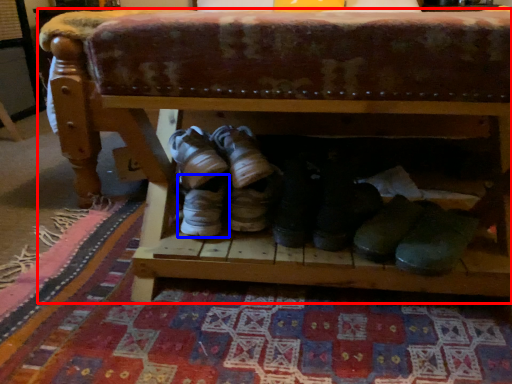
Question: Which object appears closest to the camera in this image, furniture (highlighted by a red box) or footwear (highlighted by a blue box)?

Choices:
 (A) furniture
 (B) footwear

Answer: (A)